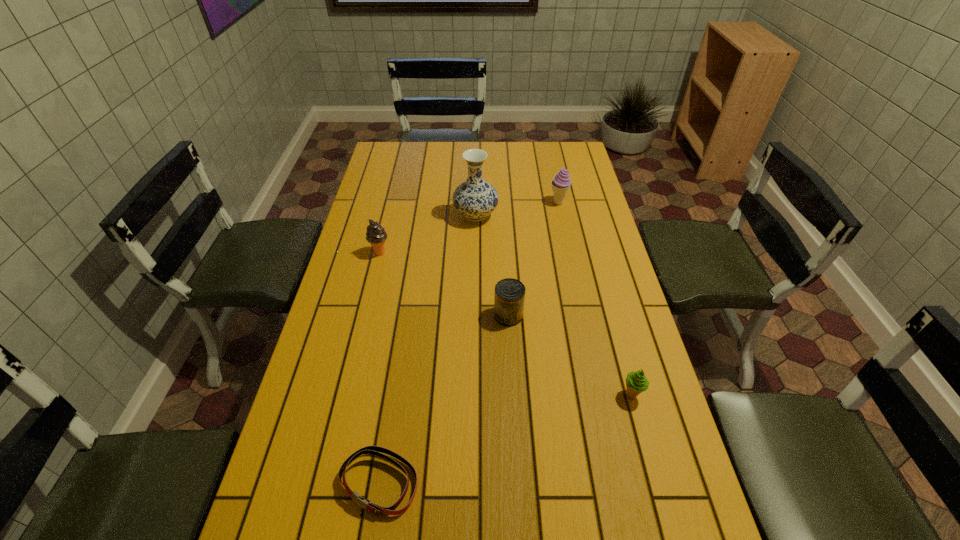
At what (x,y) coordinates should I click in order to perform the action: click on vase. Please return your answer as a coordinate pair (x, y). Image resolution: width=960 pixels, height=540 pixels. Looking at the image, I should click on (475, 198).

Where is `the farthest icecream`? Image resolution: width=960 pixels, height=540 pixels. the farthest icecream is located at coordinates (560, 185).

At what (x,y) coordinates should I click in order to perform the action: click on the second object from right to left. Please return your answer as a coordinate pair (x, y). This screenshot has height=540, width=960. Looking at the image, I should click on (560, 185).

Locate an element on the screen. This screenshot has width=960, height=540. the second nearest icecream is located at coordinates 376,235.

Find the location of a particular element. the leftmost icecream is located at coordinates (376, 235).

At what (x,y) coordinates should I click in order to perform the action: click on the nearest icecream. Please return your answer as a coordinate pair (x, y). The width and height of the screenshot is (960, 540). Looking at the image, I should click on pyautogui.click(x=636, y=382).

Image resolution: width=960 pixels, height=540 pixels. Find the location of `the rightmost icecream`. the rightmost icecream is located at coordinates (636, 382).

Identify the location of can. The height and width of the screenshot is (540, 960). (509, 297).

Locate an element on the screen. The image size is (960, 540). the shortest object is located at coordinates (375, 450).

At what (x,y) coordinates should I click in order to perform the action: click on the nearest object. Please return your answer as a coordinate pair (x, y). Looking at the image, I should click on (375, 450).